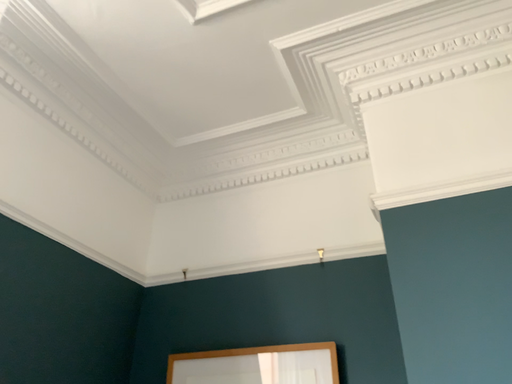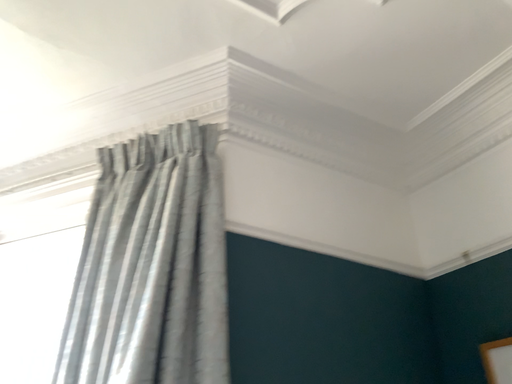
Question: How did the camera likely rotate when shooting the video?

Choices:
 (A) rotated right
 (B) rotated left

Answer: (B)